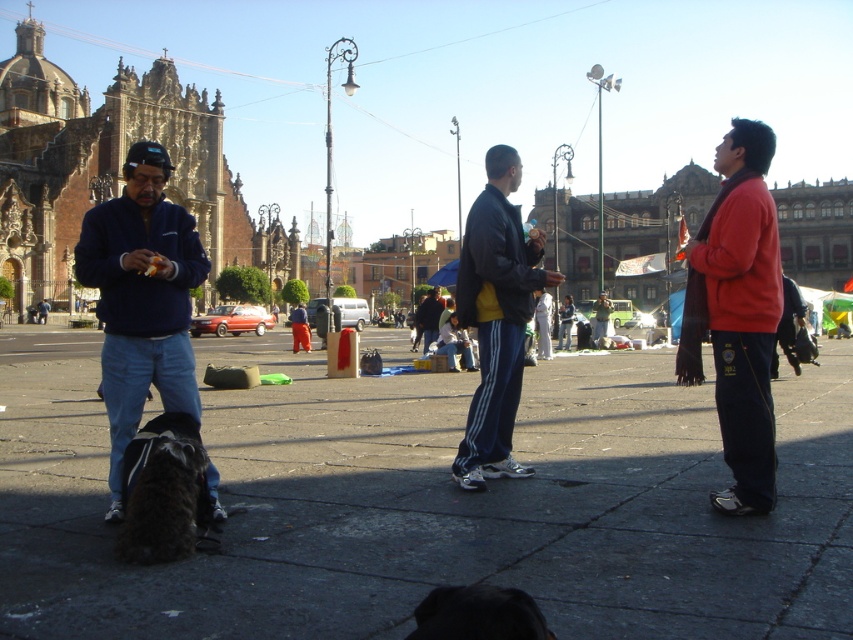
Can you confirm if red matte jacket at right is positioned above dark blue fleece jacket at left?

No, red matte jacket at right is not above dark blue fleece jacket at left.

Looking at this image, which of these two, red matte jacket at right or dark blue fleece jacket at left, stands shorter?

red matte jacket at right is shorter.

Between point (778, 312) and point (163, 305), which one is positioned behind?

Positioned behind is point (778, 312).

Find the location of `red matte jacket at right`. red matte jacket at right is located at coordinates (737, 314).

Is smooth concrete pavement at center positioned in front of shaggy dark fur dog at lower left?

Yes, smooth concrete pavement at center is in front of shaggy dark fur dog at lower left.

Looking at this image, is smooth concrete pavement at center to the left of shaggy dark fur dog at lower left from the viewer's perspective?

No, smooth concrete pavement at center is not to the left of shaggy dark fur dog at lower left.

This screenshot has width=853, height=640. What do you see at coordinates (432, 502) in the screenshot?
I see `smooth concrete pavement at center` at bounding box center [432, 502].

Identify the location of smooth concrete pavement at center. (432, 502).

In the scene shown: Who is positioned more to the left, dark blue fleece jacket at left or shaggy dark fur dog at lower left?

Positioned to the left is dark blue fleece jacket at left.

Find the location of a particular element. dark blue fleece jacket at left is located at coordinates (141, 300).